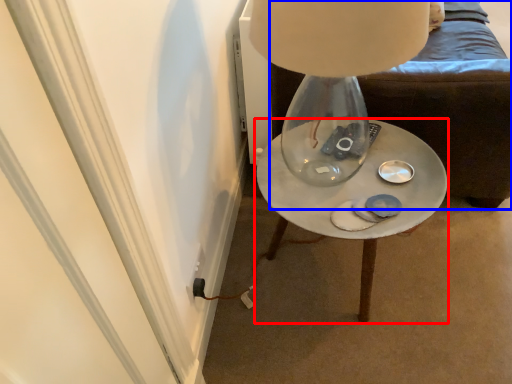
Question: Which object is closer to the camera taking this photo, table (highlighted by a red box) or furniture (highlighted by a blue box)?

Choices:
 (A) table
 (B) furniture

Answer: (B)